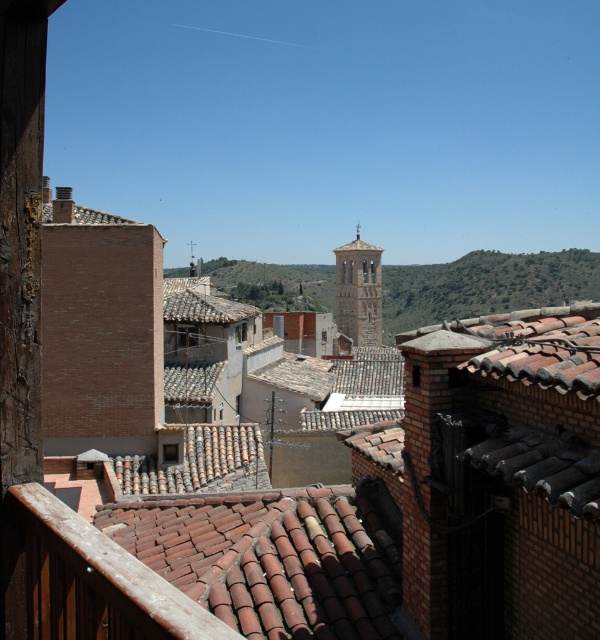
Is terracotta clay tiles at center shorter than light brown stone bell tower at center?

Yes, terracotta clay tiles at center is shorter than light brown stone bell tower at center.

Is terracotta clay tiles at center bigger than light brown stone bell tower at center?

Incorrect, terracotta clay tiles at center is not larger than light brown stone bell tower at center.

Is point (397, 593) behind point (373, 273)?

No, (397, 593) is in front of (373, 273).

Identify the location of terracotta clay tiles at center. The width and height of the screenshot is (600, 640). pos(271,557).

Measure the distance between terracotta clay tiles at center and green grassy hillside at center.

They are 741.80 feet apart.

Is terracotta clay tiles at center wider than green grassy hillside at center?

No.

Is point (325, 497) closer to viewer compared to point (469, 304)?

Yes, it is in front of point (469, 304).

Locate an element on the screen. This screenshot has height=640, width=600. terracotta clay tiles at center is located at coordinates click(271, 557).

Where is `green grassy hillside at center`? green grassy hillside at center is located at coordinates (484, 285).

Which is below, green grassy hillside at center or light brown stone bell tower at center?

light brown stone bell tower at center is below.

Is point (577, 264) positioned behind point (361, 276)?

That is True.

Locate an element on the screen. Image resolution: width=600 pixels, height=640 pixels. green grassy hillside at center is located at coordinates point(484,285).